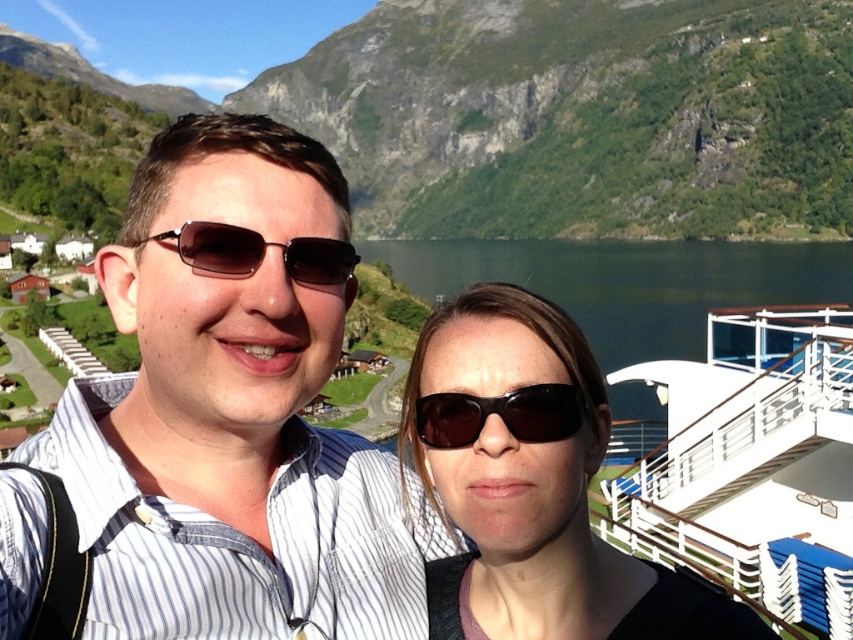
Question: Which point is farther to the camera?

Choices:
 (A) matte brown sunglasses at center
 (B) dark blue water at center
 (C) white glossy boat at right
 (D) matte black sunglasses at center

Answer: (B)

Question: Can you confirm if dark blue water at center is bigger than brown matte sunglasses at center?

Choices:
 (A) yes
 (B) no

Answer: (A)

Question: Can you confirm if green textured mountain at upper center is bigger than dark blue water at center?

Choices:
 (A) no
 (B) yes

Answer: (B)

Question: Which object appears farthest from the camera in this image?

Choices:
 (A) white glossy boat at right
 (B) black matte sunglasses at center
 (C) matte black sunglasses at center

Answer: (A)

Question: Which object appears closest to the camera in this image?

Choices:
 (A) brown matte sunglasses at center
 (B) dark blue water at center
 (C) black matte sunglasses at center
 (D) white glossy boat at right

Answer: (A)

Question: Can you confirm if matte black sunglasses at center is positioned to the right of dark blue water at center?

Choices:
 (A) no
 (B) yes

Answer: (A)